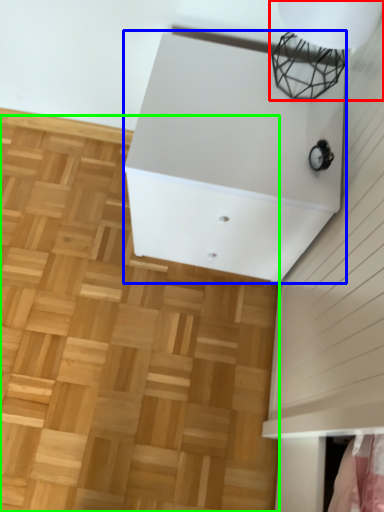
Question: Estimate the real-world distances between objects in this image. Which object is closer to lamp (highlighted by a red box), furniture (highlighted by a blue box) or hardwood (highlighted by a green box)?

Choices:
 (A) furniture
 (B) hardwood

Answer: (A)